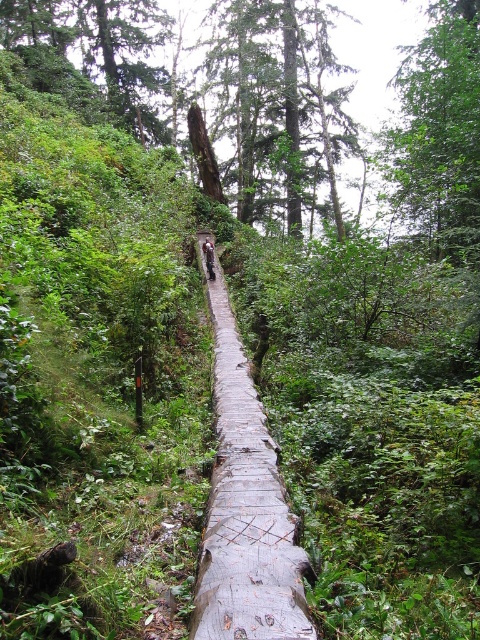
You are standing on the wooden bridge and want to walk from the starting point to the endpoint. Which point should you reach first, point (304, 99) or point (267, 604)?

You should reach point (267, 604) first because point (304, 99) is behind it.

You are standing on the narrow wooden bridge in the forest and notice two trees at the upper center of your view. Which tree is closer to you, the green rough bark tree at upper center or the green leafy tree at upper center?

The green rough bark tree at upper center is closer to you because the green leafy tree at upper center is positioned behind it.

You are standing on the wooden bridge and looking towards the forest. There are two points marked on the bridge, point A at coordinates point A is point (444, 252) and point B at point (204, 241). Which point is closer to you?

Point A at coordinates point (444, 252) is closer to the camera than point B at point (204, 241).